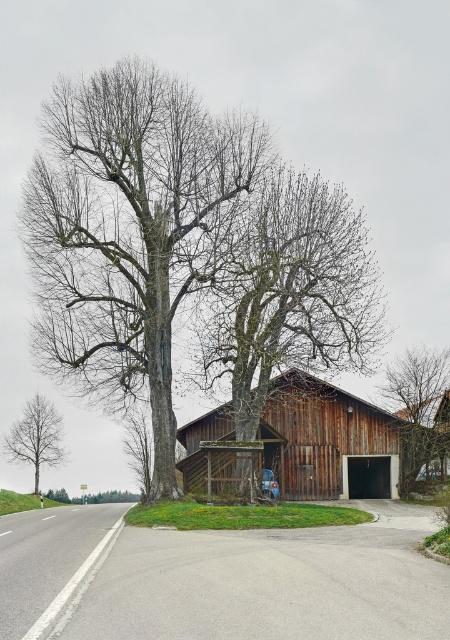
Which of these two, bare wood tree at center or smooth gray tree at left, stands shorter?

smooth gray tree at left

Is bare wood tree at center thinner than smooth gray tree at left?

No.

Who is more forward, (304, 250) or (9, 460)?

Point (304, 250) is more forward.

Where is `bare wood tree at center`? The image size is (450, 640). bare wood tree at center is located at coordinates (289, 294).

Which is more to the left, smooth bark tree at center or wooden barn at center?

From the viewer's perspective, smooth bark tree at center appears more on the left side.

The height and width of the screenshot is (640, 450). Describe the element at coordinates (130, 230) in the screenshot. I see `smooth bark tree at center` at that location.

This screenshot has height=640, width=450. Find the location of `smooth bark tree at center`. smooth bark tree at center is located at coordinates (130, 230).

Can you confirm if smooth bark tree at center is positioned to the right of bare wood tree at center?

In fact, smooth bark tree at center is to the left of bare wood tree at center.

Can you confirm if smooth bark tree at center is bigger than bare wood tree at center?

No, smooth bark tree at center is not bigger than bare wood tree at center.

Is point (136, 260) positioned in front of point (219, 332)?

No, (136, 260) is further to viewer.

Locate an element on the screen. The height and width of the screenshot is (640, 450). smooth bark tree at center is located at coordinates (130, 230).